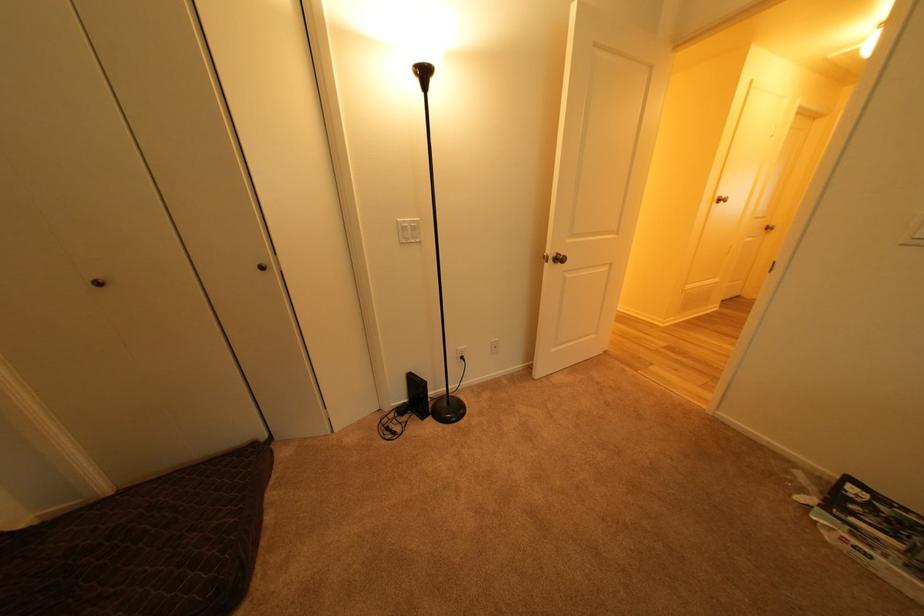
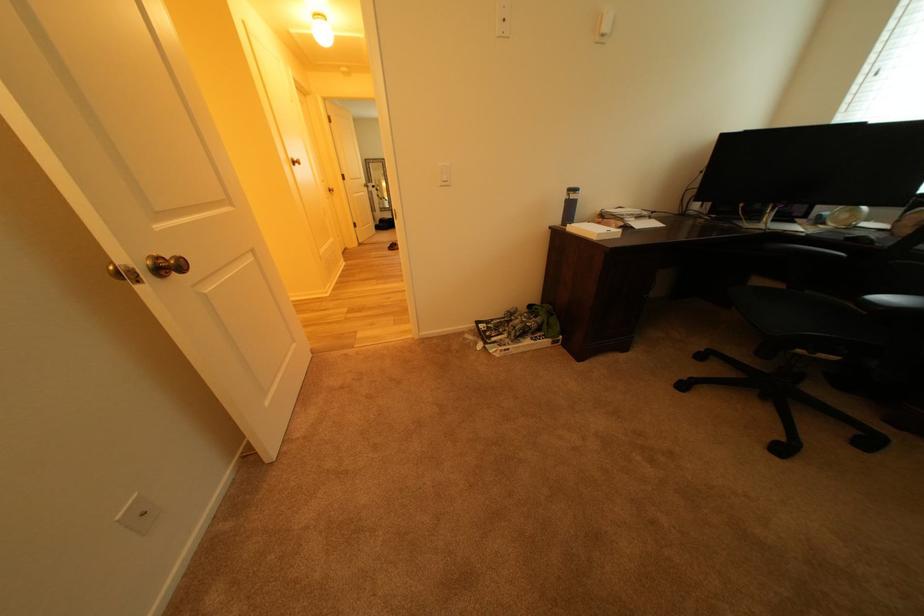
How did the camera likely rotate?

The camera rotated toward right-down.